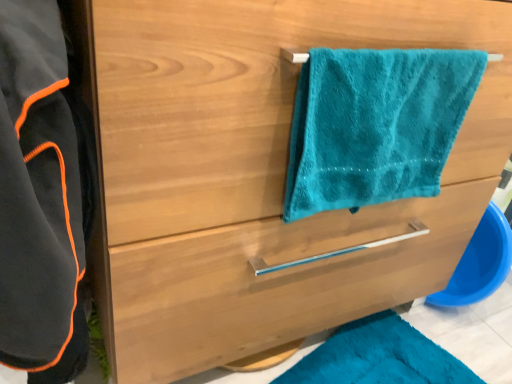
Question: Is teal plush towel at upper right positioned before satin wood drawer at center?

Choices:
 (A) no
 (B) yes

Answer: (B)

Question: From a real-world perspective, is teal plush towel at upper right below satin wood drawer at center?

Choices:
 (A) no
 (B) yes

Answer: (A)

Question: Can you see teal plush towel at upper right touching satin wood drawer at center?

Choices:
 (A) no
 (B) yes

Answer: (A)

Question: From the image's perspective, would you say teal plush towel at upper right is positioned over satin wood drawer at center?

Choices:
 (A) no
 (B) yes

Answer: (B)

Question: Can you confirm if teal plush towel at upper right is smaller than satin wood drawer at center?

Choices:
 (A) no
 (B) yes

Answer: (B)

Question: Is black fleece bathrobe at left wider or thinner than teal plush towel at upper right?

Choices:
 (A) thin
 (B) wide

Answer: (B)

Question: Considering the positions of point (56, 264) and point (368, 147), is point (56, 264) closer or farther from the camera than point (368, 147)?

Choices:
 (A) closer
 (B) farther

Answer: (A)

Question: From a real-world perspective, is black fleece bathrobe at left above or below teal plush towel at upper right?

Choices:
 (A) below
 (B) above

Answer: (A)

Question: From the image's perspective, is black fleece bathrobe at left located above or below teal plush towel at upper right?

Choices:
 (A) below
 (B) above

Answer: (A)

Question: From a real-world perspective, is satin wood drawer at center physically located above or below teal plush towel at upper right?

Choices:
 (A) above
 (B) below

Answer: (B)

Question: From the image's perspective, is satin wood drawer at center positioned above or below teal plush towel at upper right?

Choices:
 (A) above
 (B) below

Answer: (B)

Question: In terms of size, does satin wood drawer at center appear bigger or smaller than teal plush towel at upper right?

Choices:
 (A) small
 (B) big

Answer: (B)

Question: From their relative heights in the image, would you say satin wood drawer at center is taller or shorter than teal plush towel at upper right?

Choices:
 (A) short
 (B) tall

Answer: (A)

Question: Considering the positions of black fleece bathrobe at left and satin wood drawer at center in the image, is black fleece bathrobe at left wider or thinner than satin wood drawer at center?

Choices:
 (A) wide
 (B) thin

Answer: (B)

Question: From a real-world perspective, is black fleece bathrobe at left positioned above or below satin wood drawer at center?

Choices:
 (A) above
 (B) below

Answer: (A)